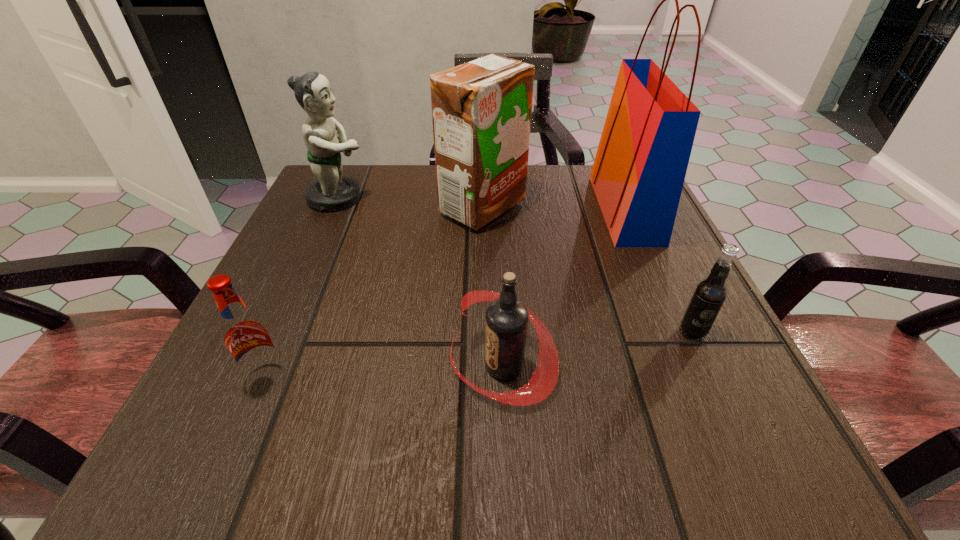
You are a GUI agent. You are given a task and a screenshot of the screen. Output one action in this format:
    pyautogui.click(x=<x>, y=<y>)
    Task: Click on the shopping bag
    Image resolution: width=960 pixels, height=540 pixels.
    Given the screenshot: What is the action you would take?
    pyautogui.click(x=638, y=173)

You are a GUI agent. You are given a task and a screenshot of the screen. Output one action in this format:
    pyautogui.click(x=<x>, y=<y>)
    Task: Click on the carton
    
    Given the screenshot: What is the action you would take?
    pyautogui.click(x=481, y=110)

Find the location of a particular element. The height and width of the screenshot is (540, 960). figurine is located at coordinates 330,191.

This screenshot has width=960, height=540. I want to click on the leftmost root beer, so (245, 334).

Locate an element on the screen. The height and width of the screenshot is (540, 960). the second root beer from left to right is located at coordinates (507, 318).

The width and height of the screenshot is (960, 540). Identify the location of the rightmost root beer. (710, 293).

The image size is (960, 540). Find the location of `vacant space located on the handle side of the tallest object`. vacant space located on the handle side of the tallest object is located at coordinates (461, 209).

Where is `vacant space located 0.120m on the handle side of the tallest object`? vacant space located 0.120m on the handle side of the tallest object is located at coordinates (541, 209).

The image size is (960, 540). Identify the location of vacant space located on the handle side of the tallest object. pyautogui.click(x=480, y=209).

What are the coordinates of `vacant space located on the straw side of the carton` in the screenshot? It's located at (359, 207).